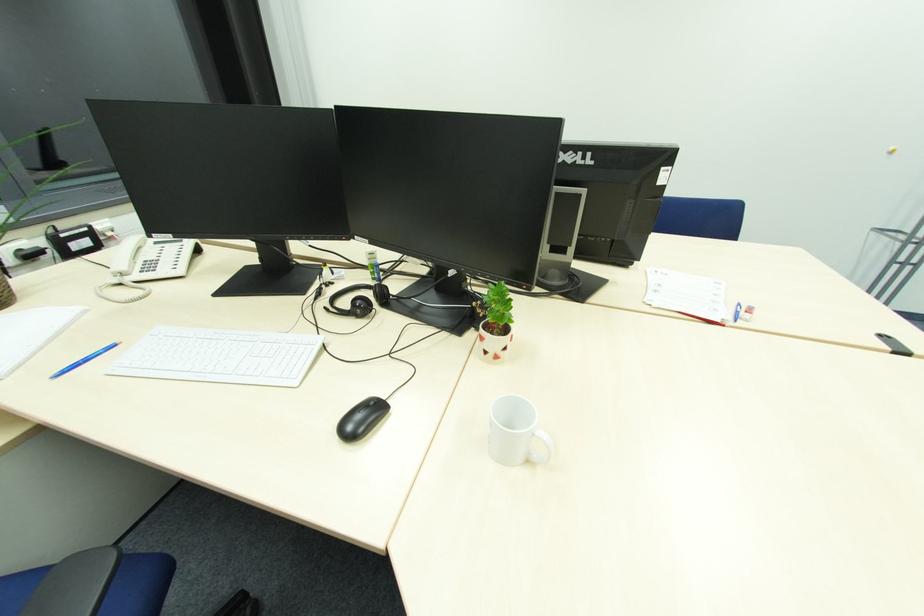
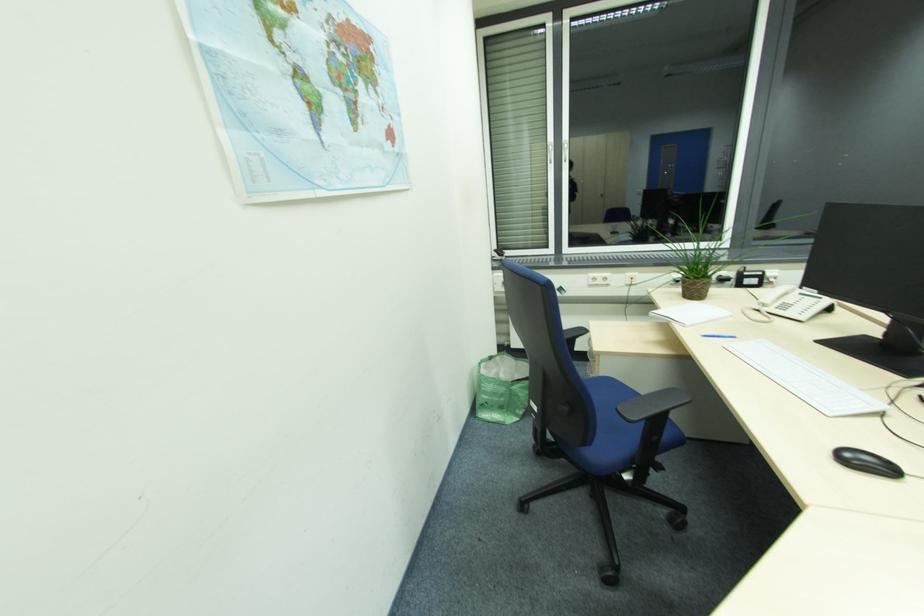
Based on the continuous images, in which direction is the camera rotating?

The camera's rotation is toward left-down.